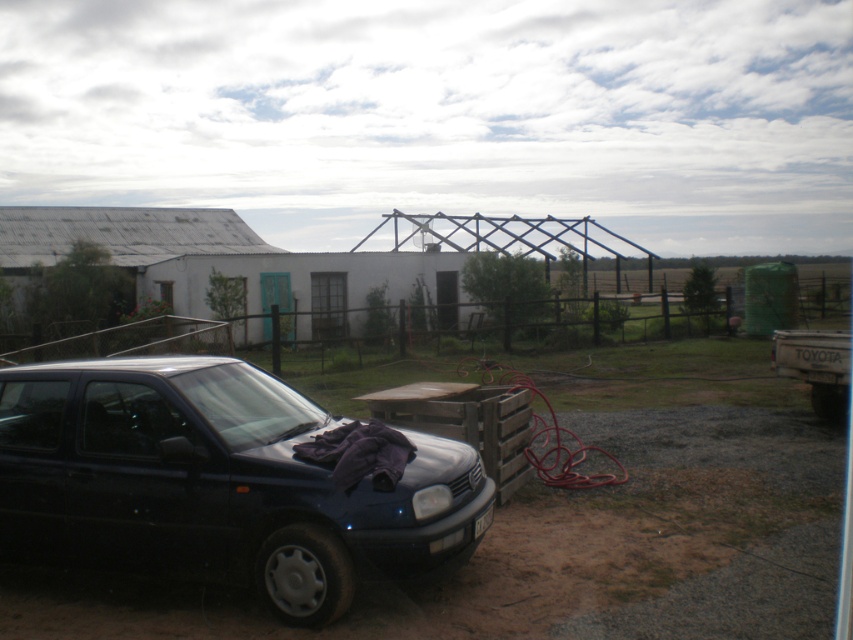
You are a delivery person who needs to park your van in this area. The van is 10 feet long. There is a shiny black car at lower left and a black plastic license plate at lower center. Can you fit your van between them without overlapping?

The distance between the shiny black car at lower left and the black plastic license plate at lower center is 5.04 feet. Since the van is 10 feet long, it cannot fit in the space between them.

You are a delivery person trying to park your vehicle in the area near the building. You see a black matte car at lower left and a shiny black car at lower left. Which car is positioned closer to the entrance of the building?

The black matte car at lower left is closer to the viewer than the shiny black car at lower left, so it is positioned closer to the entrance of the building.

You are a delivery person trying to park your car in the parking lot near the building. You see a black matte car at lower left and a black plastic license plate at lower center. Which object is positioned to the right side of the other?

The black matte car at lower left is to the right of the black plastic license plate at lower center, so the black matte car at lower left is positioned to the right side of the black plastic license plate at lower center.